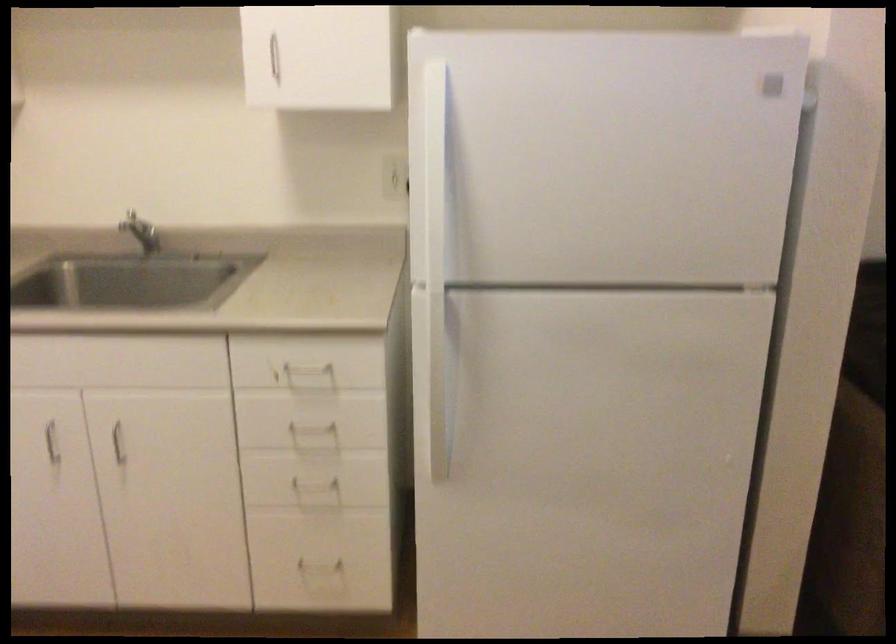
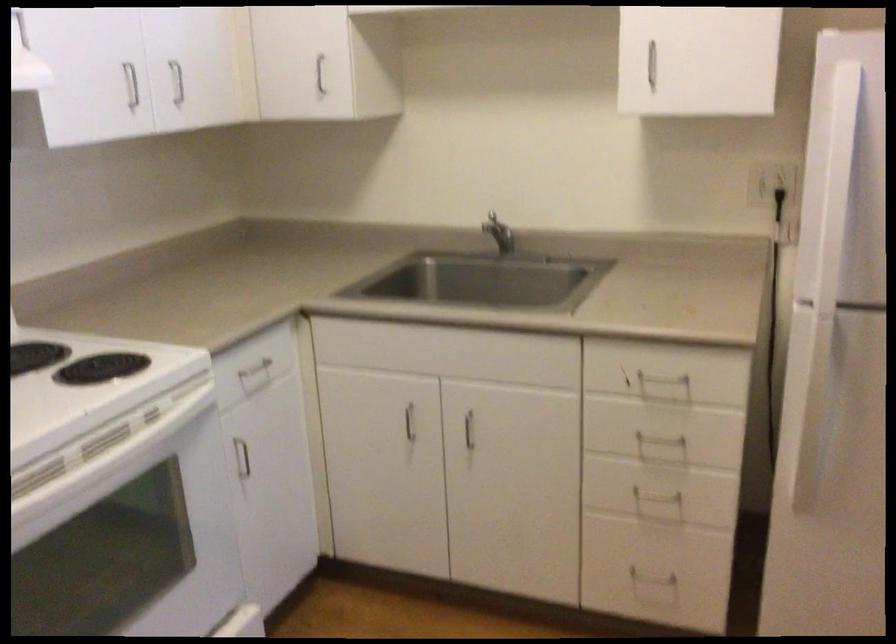
Question: The camera is either moving clockwise (left) or counter-clockwise (right) around the object. The first image is from the beginning of the video and the second image is from the end. Is the camera moving left or right when shooting the video?

Choices:
 (A) Left
 (B) Right

Answer: (B)